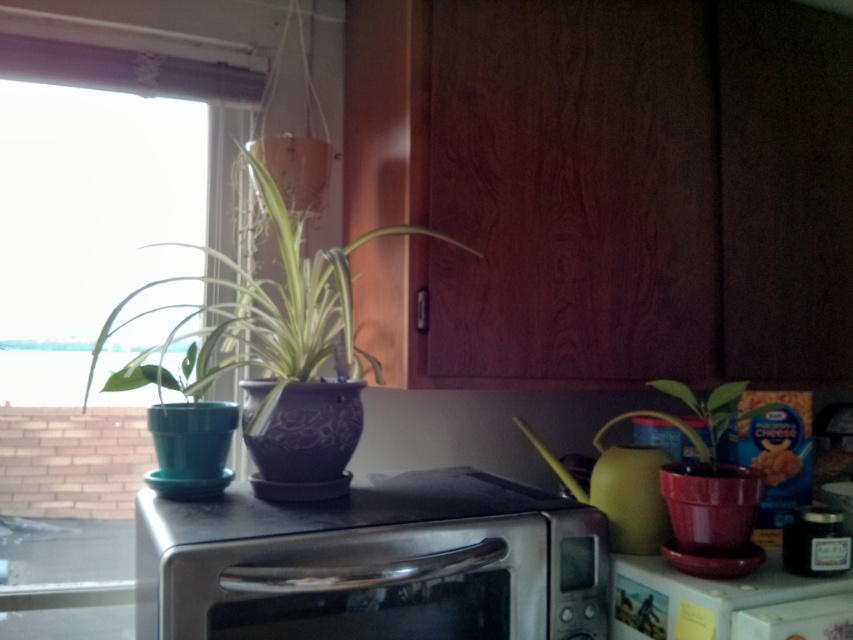
Which is above, satin silver microwave at center or matte purple pot at left?

Positioned higher is matte purple pot at left.

Which is below, satin silver microwave at center or matte purple pot at left?

satin silver microwave at center is lower down.

You are a GUI agent. You are given a task and a screenshot of the screen. Output one action in this format:
    pyautogui.click(x=<x>, y=<y>)
    Task: Click on the satin silver microwave at center
    This screenshot has width=853, height=640.
    Given the screenshot: What is the action you would take?
    pyautogui.click(x=374, y=563)

Is transparent glass door at left above green matte plant at center?

Yes, transparent glass door at left is above green matte plant at center.

Can you confirm if transparent glass door at left is bigger than green matte plant at center?

Yes.

Image resolution: width=853 pixels, height=640 pixels. I want to click on transparent glass door at left, so click(70, 460).

Does satin silver microwave at center have a greater width compared to green matte plant at center?

Yes.

This screenshot has height=640, width=853. What do you see at coordinates (374, 563) in the screenshot? I see `satin silver microwave at center` at bounding box center [374, 563].

Identify the location of satin silver microwave at center. The width and height of the screenshot is (853, 640). (374, 563).